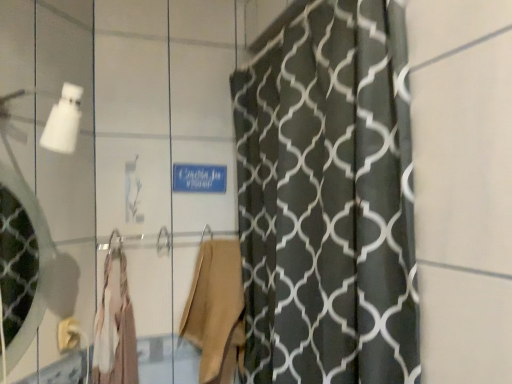
Question: Is beige fabric robe at center, the 2th robe from the left, turned away from matte gold towel bar at lower left?

Choices:
 (A) no
 (B) yes

Answer: (A)

Question: Is matte gold towel bar at lower left completely or partially inside beige fabric robe at center, which ranks as the 1th robe in right-to-left order?

Choices:
 (A) no
 (B) yes

Answer: (A)

Question: From a real-world perspective, is beige fabric robe at center, the 2th robe from the left, beneath matte gold towel bar at lower left?

Choices:
 (A) no
 (B) yes

Answer: (B)

Question: Is beige fabric robe at center, the 2th robe from the left, facing towards matte gold towel bar at lower left?

Choices:
 (A) yes
 (B) no

Answer: (B)

Question: Is beige fabric robe at center, which ranks as the 1th robe in right-to-left order, positioned in front of matte gold towel bar at lower left?

Choices:
 (A) no
 (B) yes

Answer: (A)

Question: Is beige fabric robe at center, the 2th robe from the left, to the left of matte gold towel bar at lower left from the viewer's perspective?

Choices:
 (A) no
 (B) yes

Answer: (A)

Question: Is light beige fabric robe at center, which is counted as the first robe, starting from the left, bigger than beige fabric robe at center, the 2th robe from the left?

Choices:
 (A) yes
 (B) no

Answer: (B)

Question: Is beige fabric robe at center, which ranks as the 1th robe in right-to-left order, inside light beige fabric robe at center, which is counted as the first robe, starting from the left?

Choices:
 (A) no
 (B) yes

Answer: (A)

Question: Can you confirm if light beige fabric robe at center, which is counted as the first robe, starting from the left, is taller than beige fabric robe at center, which ranks as the 1th robe in right-to-left order?

Choices:
 (A) yes
 (B) no

Answer: (B)

Question: Considering the relative sizes of light beige fabric robe at center, which is counted as the first robe, starting from the left, and beige fabric robe at center, the 2th robe from the left, in the image provided, is light beige fabric robe at center, which is counted as the first robe, starting from the left, wider than beige fabric robe at center, the 2th robe from the left,?

Choices:
 (A) yes
 (B) no

Answer: (B)

Question: Can you confirm if light beige fabric robe at center, acting as the second robe starting from the right, is shorter than beige fabric robe at center, the 2th robe from the left?

Choices:
 (A) no
 (B) yes

Answer: (B)

Question: Does matte gold towel bar at lower left have a greater width compared to light beige fabric robe at center, acting as the second robe starting from the right?

Choices:
 (A) yes
 (B) no

Answer: (B)